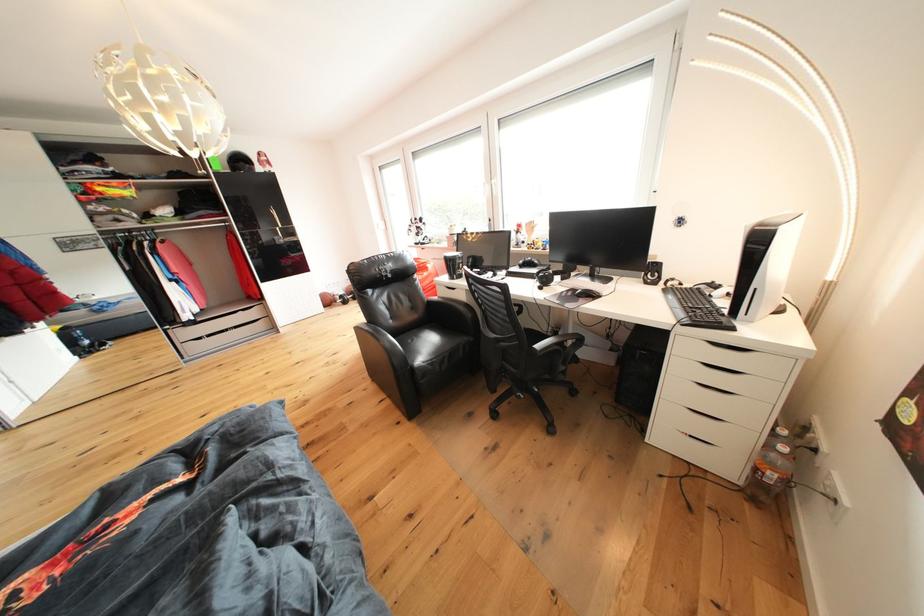
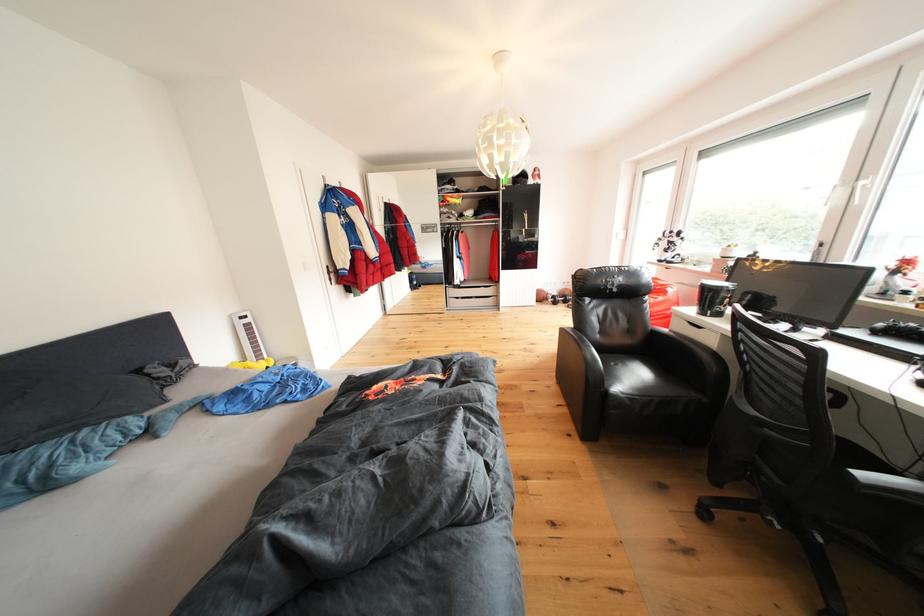
The point at [530,267] is marked in the first image. Where is the corresponding point in the second image?

(890, 330)